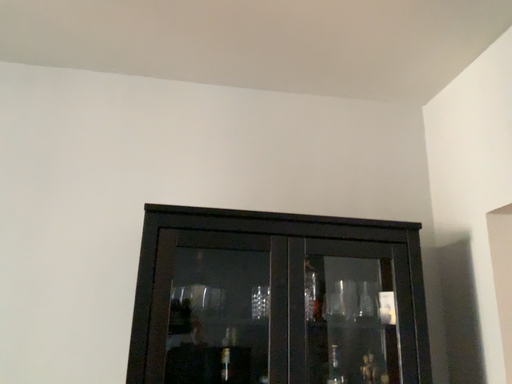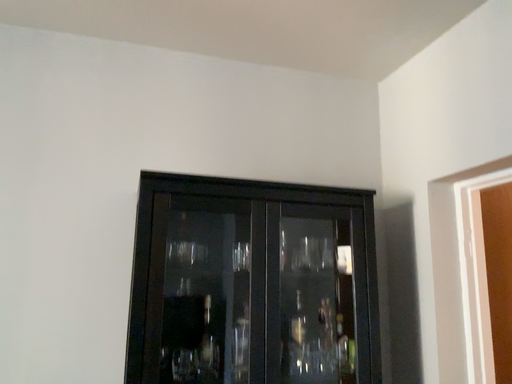
Question: How did the camera likely rotate when shooting the video?

Choices:
 (A) rotated downward
 (B) rotated upward

Answer: (A)